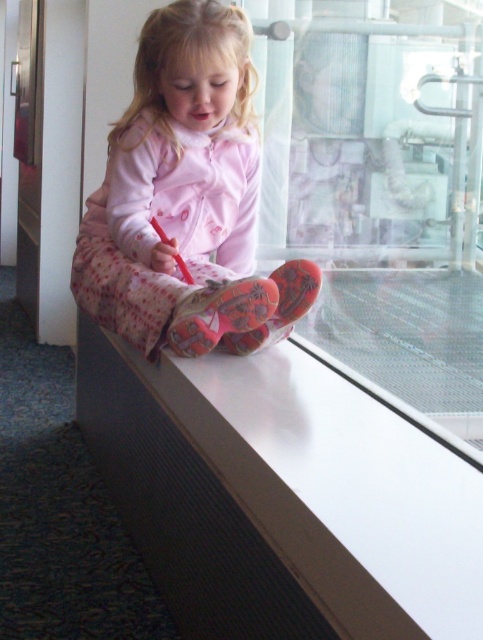
You are a robot navigating the scene. You need to move from the point at coordinates point (285, 118) to the point at coordinates point (409, 628). According to the scene description, which direction should you move relative to the starting point?

You should move forward because point (409, 628) is in front of point (285, 118).

You are a delivery robot in a public building. You need to deliver a package to a specific point marked at coordinates point (368, 572). The robot has a maximum reach of 35 inches. Can you reach the point from your current position?

The distance of point (368, 572) from camera is 36.22 inches, so the robot cannot reach the point as it exceeds the maximum reach of 35 inches.